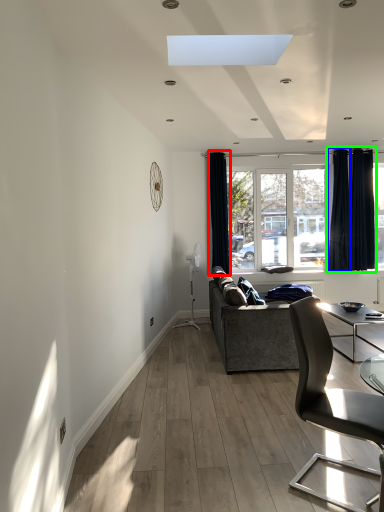
Question: Estimate the real-world distances between objects in this image. Which object is farther from curtain (highlighted by a red box), curtain (highlighted by a blue box) or curtain (highlighted by a green box)?

Choices:
 (A) curtain
 (B) curtain

Answer: (B)